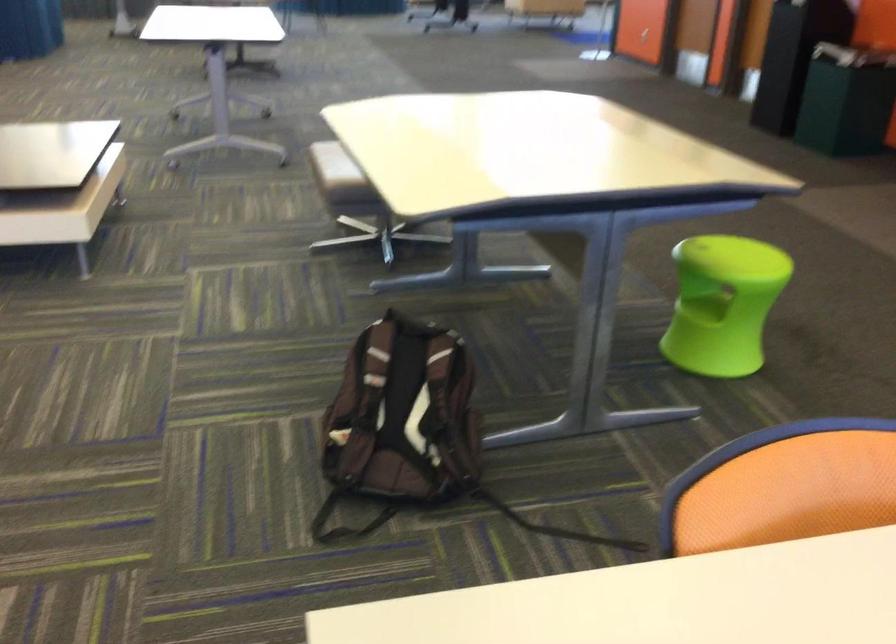
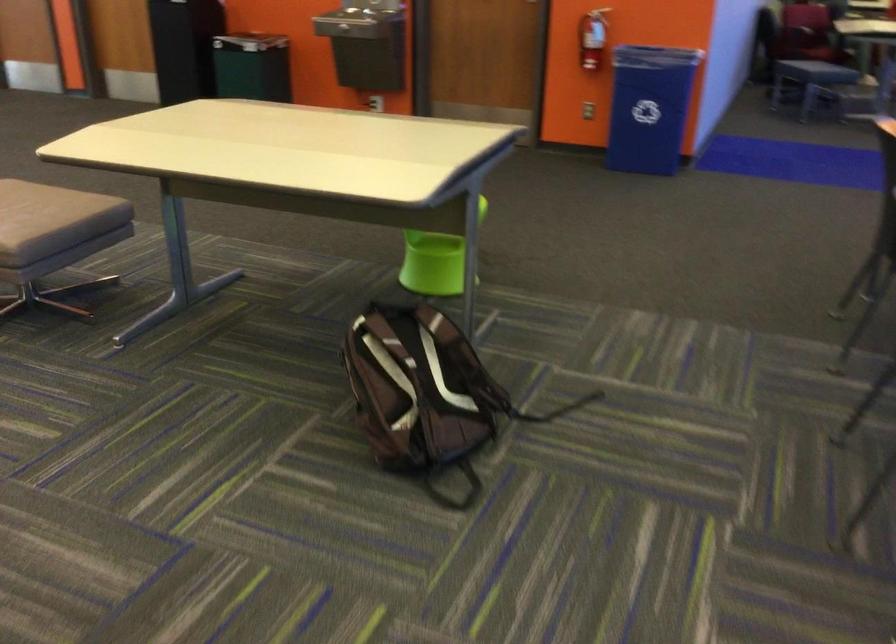
Find the pixel in the second image that matches (685,327) in the first image.

(435, 261)